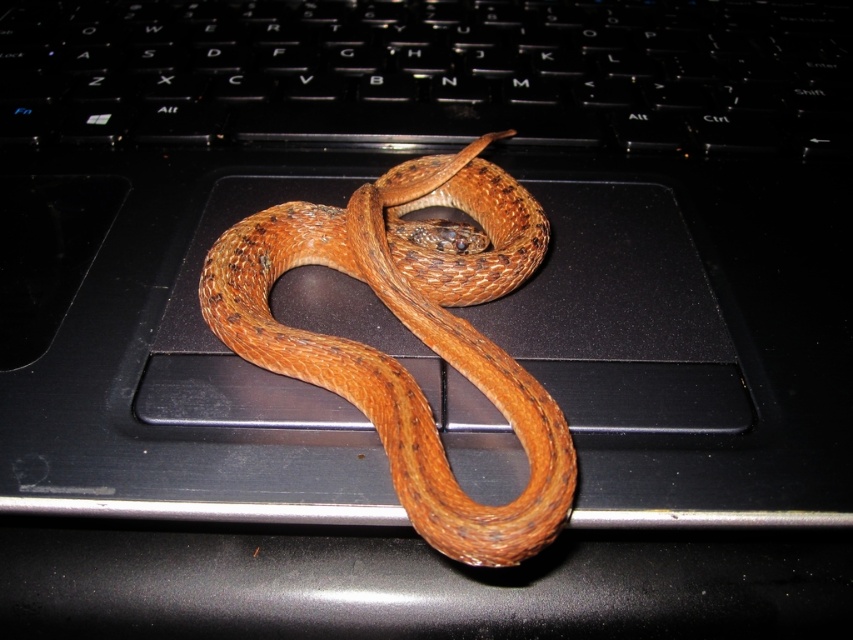
Which is below, black plastic keyboard at center or brown scaly snake at center?

Result: brown scaly snake at center is below.

Does point (265, 77) lie behind point (456, 534)?

Yes, it is behind point (456, 534).

You are a GUI agent. You are given a task and a screenshot of the screen. Output one action in this format:
    pyautogui.click(x=<x>, y=<y>)
    Task: Click on the black plastic keyboard at center
    This screenshot has width=853, height=640.
    Given the screenshot: What is the action you would take?
    pyautogui.click(x=432, y=74)